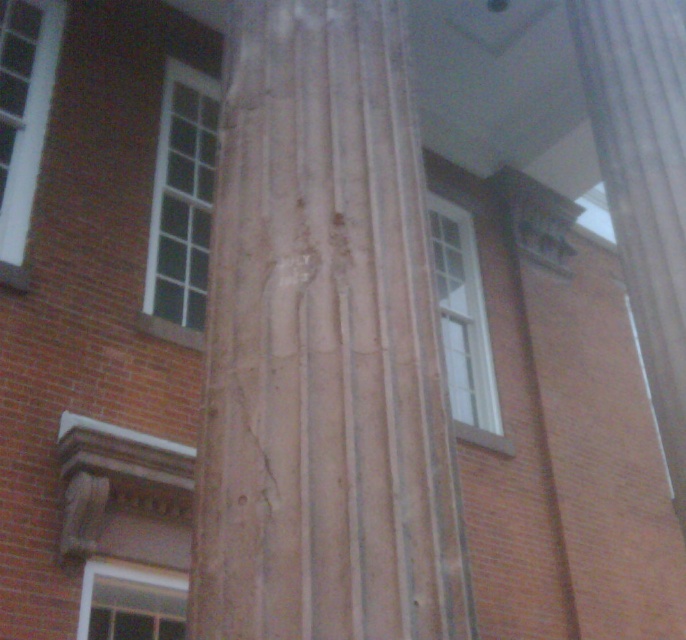
Question: In this image, where is smooth brown column at center located relative to smooth stone column at center?

Choices:
 (A) above
 (B) below

Answer: (B)

Question: Which point is closer to the camera taking this photo?

Choices:
 (A) (392, 502)
 (B) (643, 154)

Answer: (A)

Question: Does smooth brown column at center appear under smooth stone column at center?

Choices:
 (A) no
 (B) yes

Answer: (B)

Question: Which point is closer to the camera?

Choices:
 (A) (394, 77)
 (B) (685, 349)

Answer: (A)

Question: Is the position of smooth brown column at center more distant than that of smooth stone column at center?

Choices:
 (A) yes
 (B) no

Answer: (B)